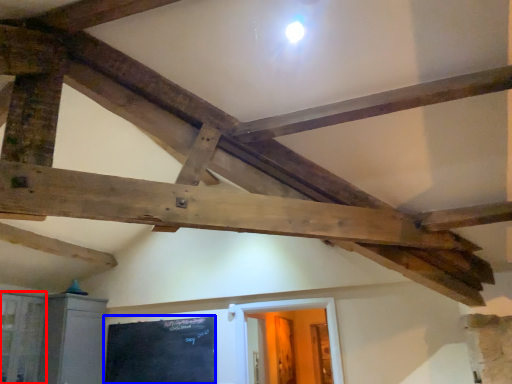
Question: Which object appears farthest to the camera in this image, window (highlighted by a red box) or bulletin board (highlighted by a blue box)?

Choices:
 (A) window
 (B) bulletin board

Answer: (B)